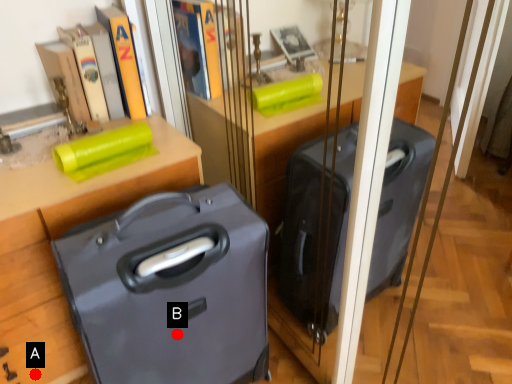
Question: Two points are circled on the image, labeled by A and B beside each circle. Which of the following is the closest to the observer?

Choices:
 (A) A is closer
 (B) B is closer

Answer: (B)